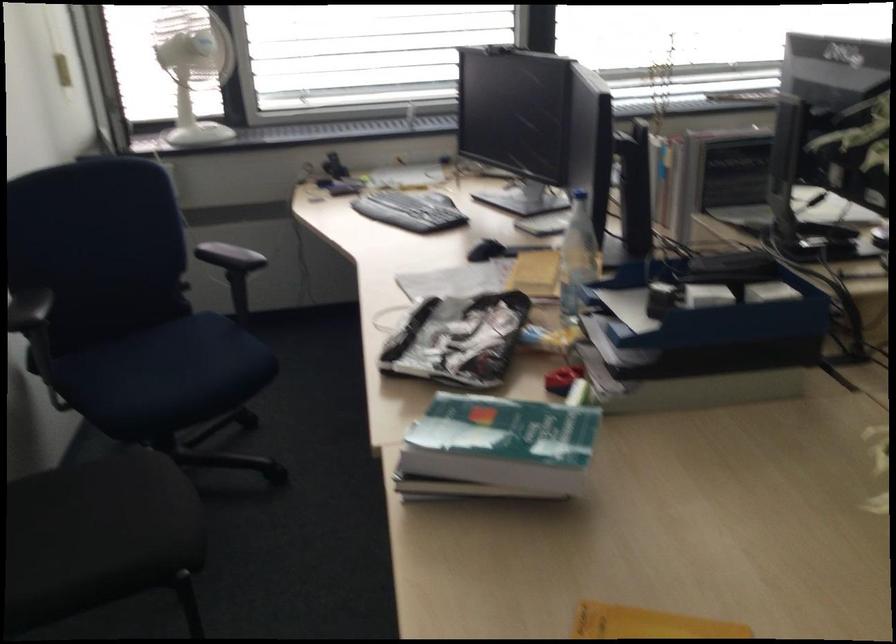
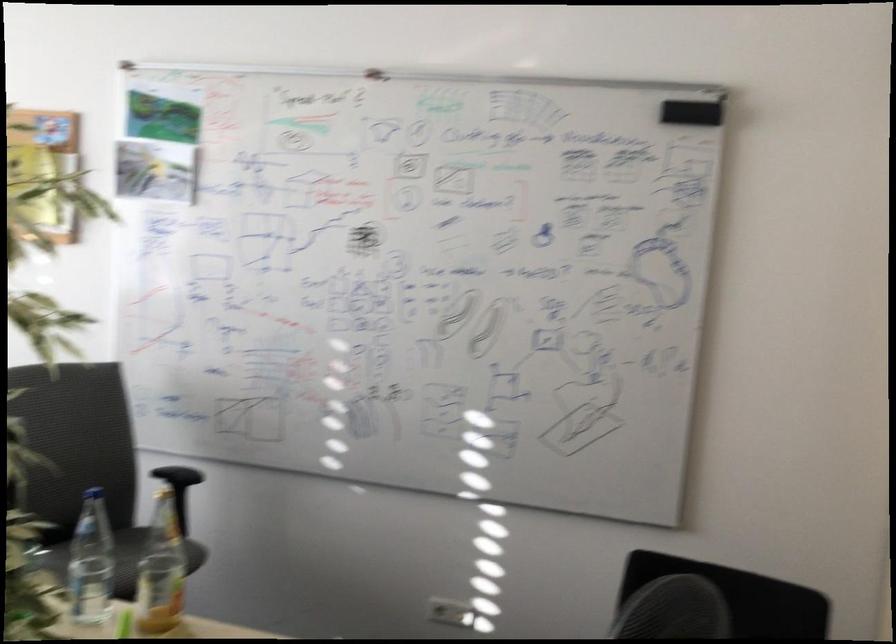
Question: Based on the continuous images, in which direction is the camera rotating? Reply with the corresponding letter.

Choices:
 (A) Left
 (B) Right
 (C) Up
 (D) Down

Answer: (B)